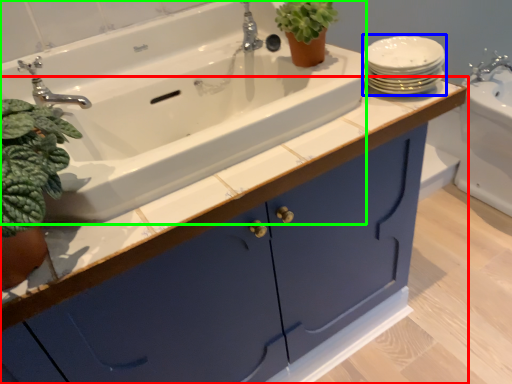
Question: Estimate the real-world distances between objects in this image. Which object is farther from bathroom cabinet (highlighted by a red box), tableware (highlighted by a blue box) or sink (highlighted by a green box)?

Choices:
 (A) tableware
 (B) sink

Answer: (A)